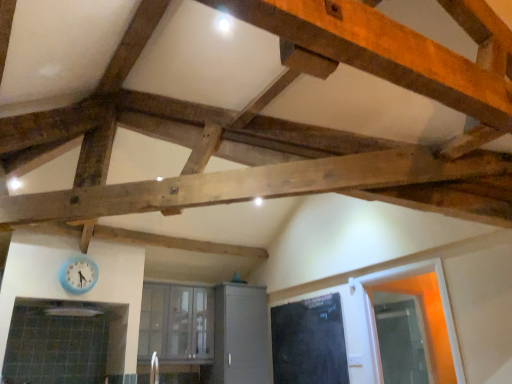
What is the approximate height of black matte door at center?

black matte door at center is 35.66 inches in height.

What are the coordinates of `transparent glass door at right` in the screenshot? It's located at (400, 338).

Considering the sizes of objects clear glass window at center and transparent glass door at right in the image provided, who is thinner, clear glass window at center or transparent glass door at right?

Thinner between the two is transparent glass door at right.

Is point (147, 316) in front of point (393, 352)?

No, it is behind (393, 352).

In the scene shown: Can you tell me how much clear glass window at center and transparent glass door at right differ in facing direction?

The angle between the facing direction of clear glass window at center and the facing direction of transparent glass door at right is 0.843 degrees.

Which object is further away from the camera taking this photo, clear glass window at center or transparent glass door at right?

clear glass window at center is more distant.

Measure the distance from matte gray cabinet at center to transparent glass door at right.

They are 1.94 meters apart.

Who is shorter, matte gray cabinet at center or transparent glass door at right?

transparent glass door at right.

Image resolution: width=512 pixels, height=384 pixels. Identify the location of cabinetry on the left of transparent glass door at right. 240,335.

From the image's perspective, is matte gray cabinet at center above transparent glass door at right?

Actually, matte gray cabinet at center appears below transparent glass door at right in the image.

Could black matte door at center be considered to be inside blue plastic clock at lower left?

No, black matte door at center is located outside of blue plastic clock at lower left.

From the image's perspective, is blue plastic clock at lower left located beneath black matte door at center?

Actually, blue plastic clock at lower left appears above black matte door at center in the image.

This screenshot has width=512, height=384. Find the location of `door that appears on the right of blue plastic clock at lower left`. door that appears on the right of blue plastic clock at lower left is located at coordinates (309, 342).

Which object is further away from the camera, blue plastic clock at lower left or black matte door at center?

black matte door at center is further from the camera.

Looking at this image, who is taller, blue plastic clock at lower left or clear glass window at center?

Standing taller between the two is clear glass window at center.

Is blue plastic clock at lower left next to clear glass window at center and touching it?

blue plastic clock at lower left and clear glass window at center are clearly separated.

From the image's perspective, which is below, blue plastic clock at lower left or clear glass window at center?

clear glass window at center.

From a real-world perspective, is blue plastic clock at lower left over clear glass window at center?

Yes, from a real-world perspective, blue plastic clock at lower left is above clear glass window at center.

Considering the positions of points (408, 329) and (75, 286), is point (408, 329) closer to camera compared to point (75, 286)?

Yes, point (408, 329) is in front of point (75, 286).

How many degrees apart are the facing directions of transparent glass door at right and blue plastic clock at lower left?

1.32 degrees.

Can you confirm if transparent glass door at right is positioned to the right of blue plastic clock at lower left?

Yes.

Is transparent glass door at right in contact with blue plastic clock at lower left?

transparent glass door at right and blue plastic clock at lower left are not in contact.

Is clear glass window at center far away from blue plastic clock at lower left?

Yes.

Is blue plastic clock at lower left surrounded by clear glass window at center?

No, blue plastic clock at lower left is not inside clear glass window at center.

From a real-world perspective, who is located higher, clear glass window at center or blue plastic clock at lower left?

blue plastic clock at lower left, from a real-world perspective.

From the image's perspective, is clear glass window at center under blue plastic clock at lower left?

Correct, clear glass window at center appears lower than blue plastic clock at lower left in the image.

Is blue plastic clock at lower left in front of transparent glass door at right?

Yes, blue plastic clock at lower left is in front of transparent glass door at right.

Is blue plastic clock at lower left not within transparent glass door at right?

That's correct, blue plastic clock at lower left is outside of transparent glass door at right.

From a real-world perspective, who is located higher, blue plastic clock at lower left or transparent glass door at right?

In real-world perspective, blue plastic clock at lower left is above.

At what (x,y) coordinates should I click in order to perform the action: click on glass door in front of the clear glass window at center. Please return your answer as a coordinate pair (x, y). Looking at the image, I should click on (400, 338).

Find the location of a particular element. cabinetry above the transparent glass door at right (from a real-world perspective) is located at coordinates (240, 335).

Considering their positions, is black matte door at center positioned further to matte gray cabinet at center than blue plastic clock at lower left?

Based on the image, blue plastic clock at lower left appears to be further to matte gray cabinet at center.

Considering their positions, is clear glass window at center positioned further to black matte door at center than transparent glass door at right?

Based on the image, clear glass window at center appears to be further to black matte door at center.

Looking at the image, which one is located further to clear glass window at center, black matte door at center or transparent glass door at right?

transparent glass door at right is positioned further to the anchor clear glass window at center.

When comparing their distances from blue plastic clock at lower left, does matte gray cabinet at center or clear glass window at center seem closer?

matte gray cabinet at center is closer to blue plastic clock at lower left.

Considering their positions, is black matte door at center positioned further to blue plastic clock at lower left than clear glass window at center?

Among the two, black matte door at center is located further to blue plastic clock at lower left.

Based on their spatial positions, is matte gray cabinet at center or blue plastic clock at lower left further from clear glass window at center?

Based on the image, blue plastic clock at lower left appears to be further to clear glass window at center.

Consider the image. Looking at the image, which one is located further to transparent glass door at right, blue plastic clock at lower left or clear glass window at center?

clear glass window at center is further to transparent glass door at right.

Considering their positions, is transparent glass door at right positioned closer to black matte door at center than matte gray cabinet at center?

transparent glass door at right is positioned closer to the anchor black matte door at center.

Where is `door between clear glass window at center and transparent glass door at right from left to right`? This screenshot has width=512, height=384. door between clear glass window at center and transparent glass door at right from left to right is located at coordinates (309, 342).

I want to click on door between blue plastic clock at lower left and transparent glass door at right from left to right, so click(309, 342).

The height and width of the screenshot is (384, 512). I want to click on cabinetry between clear glass window at center and transparent glass door at right in the horizontal direction, so click(240, 335).

Find the location of a particular element. This screenshot has width=512, height=384. cabinetry between blue plastic clock at lower left and transparent glass door at right is located at coordinates (240, 335).